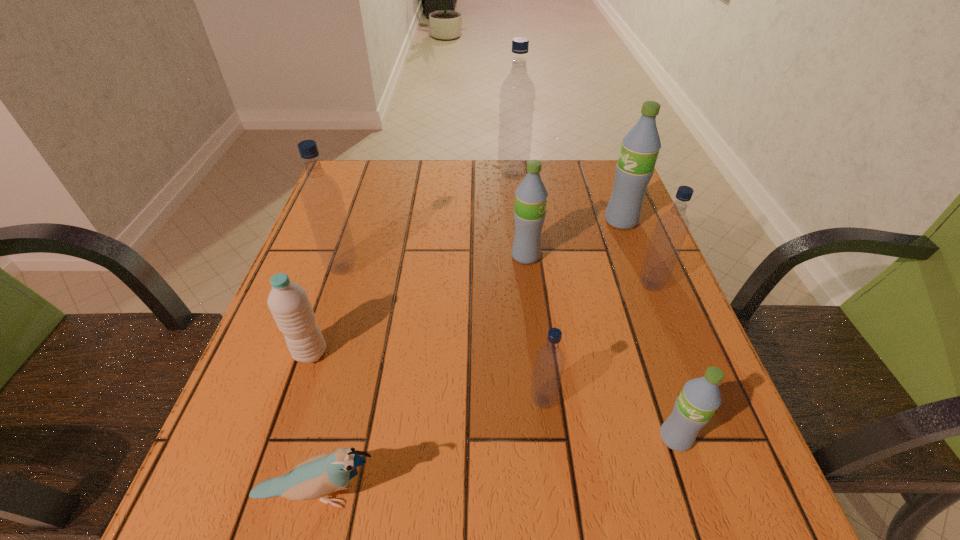
Select which green water bottle is the second closest to the blue bird. Please provide its 2D coordinates. Your answer should be formatted as a tuple, i.e. [(x, y)], where the tuple contains the x and y coordinates of a point satisfying the conditions above.

[(531, 195)]

Where is `green water bottle that can be found as the closest to the second farthest green water bottle`? The height and width of the screenshot is (540, 960). green water bottle that can be found as the closest to the second farthest green water bottle is located at coordinates (640, 147).

Where is `free spot that satisfies the following two spatial constraints: 1. on the front side of the seventh farthest water bottle; 2. on the right side of the farthest water bottle`? This screenshot has height=540, width=960. free spot that satisfies the following two spatial constraints: 1. on the front side of the seventh farthest water bottle; 2. on the right side of the farthest water bottle is located at coordinates (536, 400).

Locate an element on the screen. free space that satisfies the following two spatial constraints: 1. on the front side of the second farthest water bottle; 2. on the right side of the third biggest blue water bottle is located at coordinates (645, 285).

This screenshot has height=540, width=960. Identify the location of vacant space that satisfies the following two spatial constraints: 1. on the front side of the leftmost blue water bottle; 2. on the left side of the eighth farthest object. (286, 438).

I want to click on vacant area that satisfies the following two spatial constraints: 1. on the front side of the smallest blue water bottle; 2. on the left side of the leftmost green water bottle, so click(542, 400).